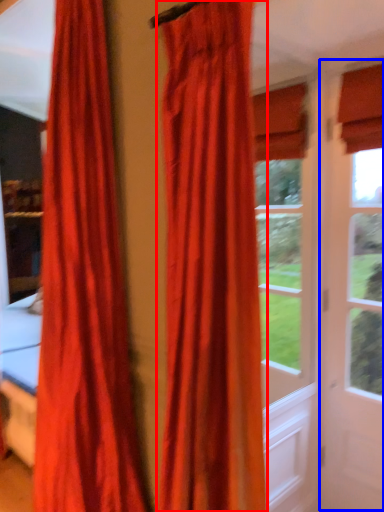
Question: Which of the following is the farthest to the observer, curtain (highlighted by a red box) or screen door (highlighted by a blue box)?

Choices:
 (A) curtain
 (B) screen door

Answer: (B)